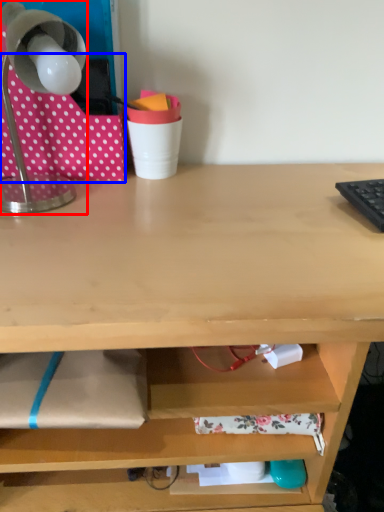
Question: Which of the following is the closest to the observer, lamp (highlighted by a red box) or fabric (highlighted by a blue box)?

Choices:
 (A) lamp
 (B) fabric

Answer: (A)